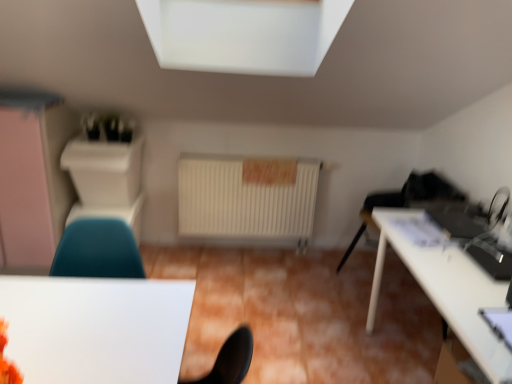
Identify the location of vacant space situated above white glossy table at right, the second table positioned from the left (from a real-world perspective). (455, 260).